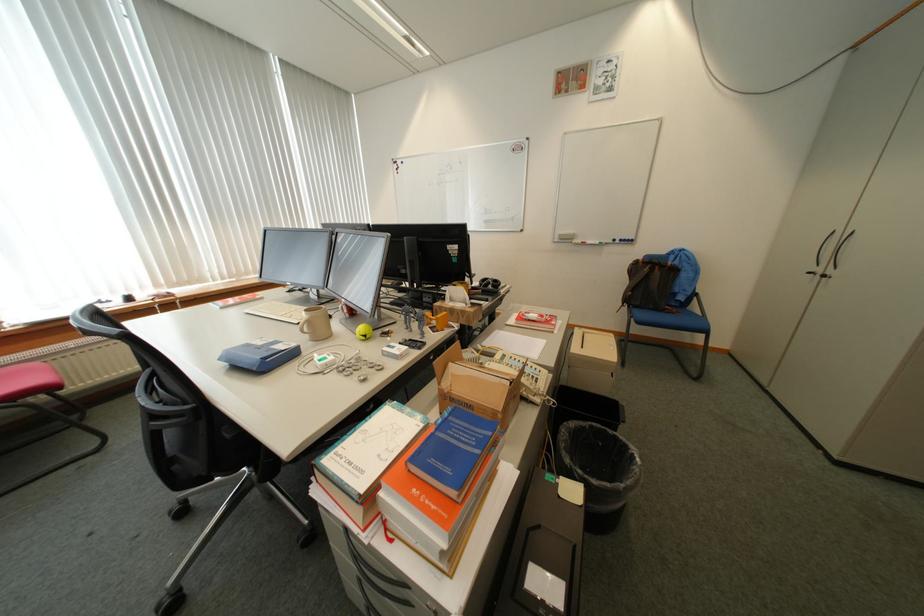
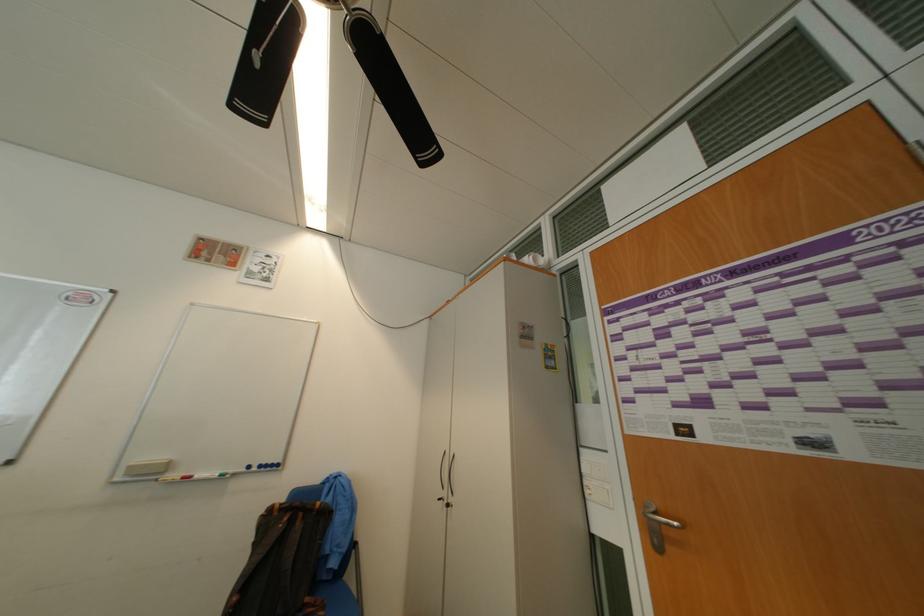
Find the pixel in the second image that matches point 576,240 in the first image.

(159, 475)